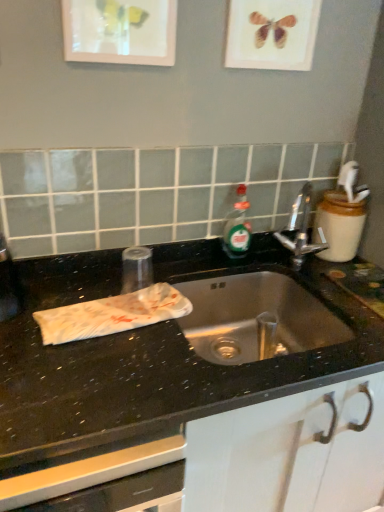
Question: Is black granite sink at center taller than matte wooden picture frame at upper center, the first picture frame in the right-to-left sequence?

Choices:
 (A) yes
 (B) no

Answer: (A)

Question: Considering the relative positions of black granite sink at center and matte wooden picture frame at upper center, the first picture frame in the right-to-left sequence, in the image provided, is black granite sink at center to the left of matte wooden picture frame at upper center, the first picture frame in the right-to-left sequence, from the viewer's perspective?

Choices:
 (A) no
 (B) yes

Answer: (A)

Question: Could you tell me if black granite sink at center is facing matte wooden picture frame at upper center, the second picture frame from the left?

Choices:
 (A) no
 (B) yes

Answer: (A)

Question: Is black granite sink at center behind matte wooden picture frame at upper center, the first picture frame in the right-to-left sequence?

Choices:
 (A) yes
 (B) no

Answer: (B)

Question: Does black granite sink at center lie in front of matte wooden picture frame at upper center, the first picture frame in the right-to-left sequence?

Choices:
 (A) yes
 (B) no

Answer: (A)

Question: Is black granite sink at center bigger than matte wooden picture frame at upper center, the first picture frame in the right-to-left sequence?

Choices:
 (A) no
 (B) yes

Answer: (B)

Question: Is white paper towel at left further to camera compared to polished chrome faucet at center?

Choices:
 (A) no
 (B) yes

Answer: (A)

Question: Is white paper towel at left positioned far away from polished chrome faucet at center?

Choices:
 (A) no
 (B) yes

Answer: (A)

Question: Does white paper towel at left turn towards polished chrome faucet at center?

Choices:
 (A) yes
 (B) no

Answer: (B)

Question: Is white paper towel at left at the left side of polished chrome faucet at center?

Choices:
 (A) yes
 (B) no

Answer: (A)

Question: Is white paper towel at left wider than polished chrome faucet at center?

Choices:
 (A) yes
 (B) no

Answer: (B)

Question: From a real-world perspective, is white paper towel at left positioned under polished chrome faucet at center based on gravity?

Choices:
 (A) yes
 (B) no

Answer: (A)

Question: From a real-world perspective, does matte glass picture frame at upper center, the first picture frame positioned from the left, stand above polished chrome faucet at center?

Choices:
 (A) no
 (B) yes

Answer: (B)